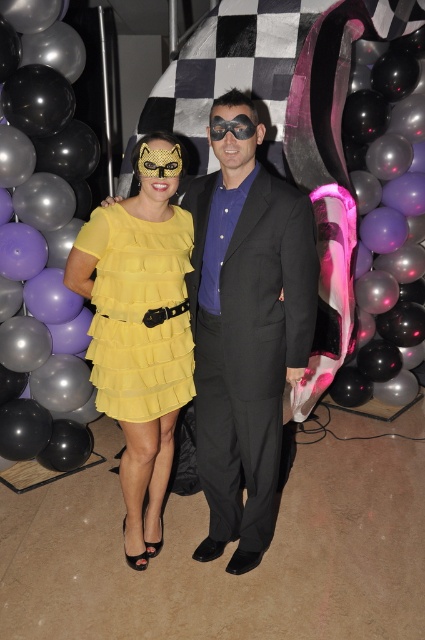
You are a photographer setting up for a photo shoot. You need to ensure that the black glossy balloon at left and the yellow tulle dress at center are both visible in the frame. Given their sizes, which object should you focus on first to ensure proper framing?

The black glossy balloon at left is much taller than the yellow tulle dress at center, so you should focus on positioning the camera to include the taller balloon first to ensure both are visible.

You are a photographer setting up for a photoshoot and need to ensure the yellow tulle dress at center and the yellow chiffon dress at center are visible in the frame. Based on their positions, which dress should you focus on first to capture both in the shot?

The yellow tulle dress at center is located below the yellow chiffon dress at center, so you should focus on the yellow chiffon dress at center first to ensure both are in the frame.